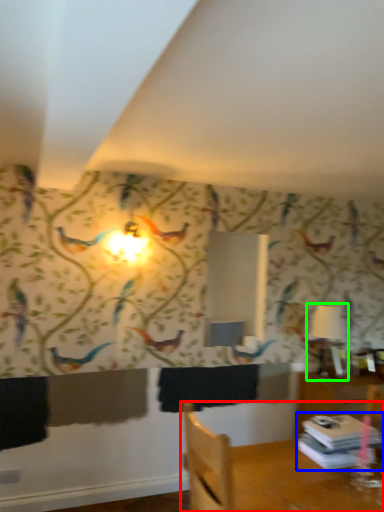
Question: Which object is positioned closest to furniture (highlighted by a red box)? Select from book (highlighted by a blue box) and table lamp (highlighted by a green box).

Choices:
 (A) book
 (B) table lamp

Answer: (A)